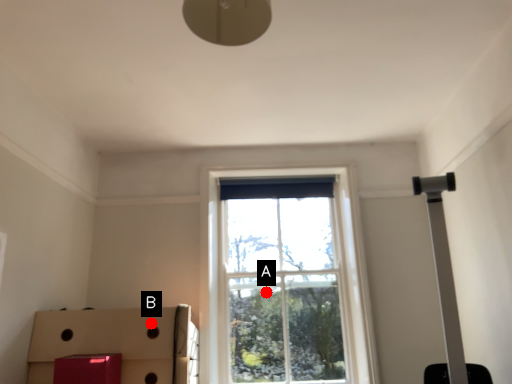
Question: Two points are circled on the image, labeled by A and B beside each circle. Which point is closer to the camera?

Choices:
 (A) A is closer
 (B) B is closer

Answer: (B)